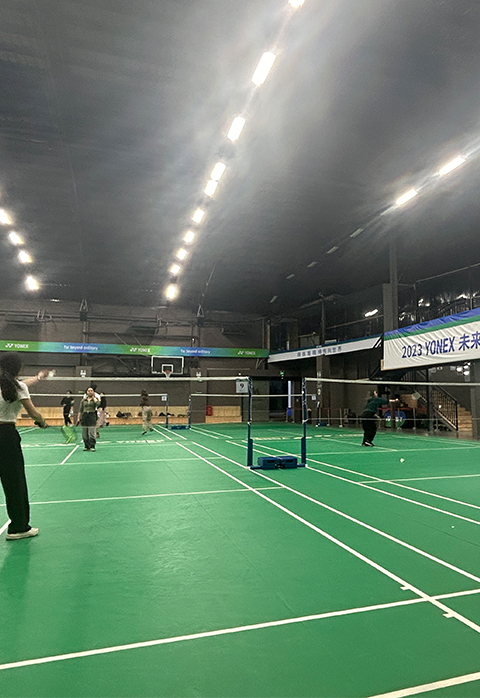
Image resolution: width=480 pixels, height=698 pixels. What are the coordinates of `stairs` in the screenshot? It's located at (461, 419).